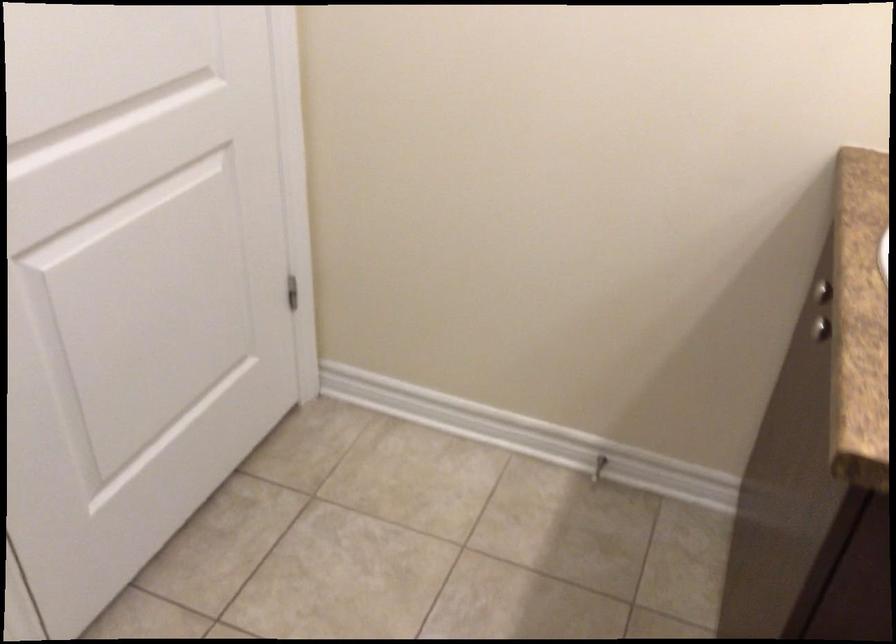
Which object does [598,468] point to?

It refers to a spring door stop.